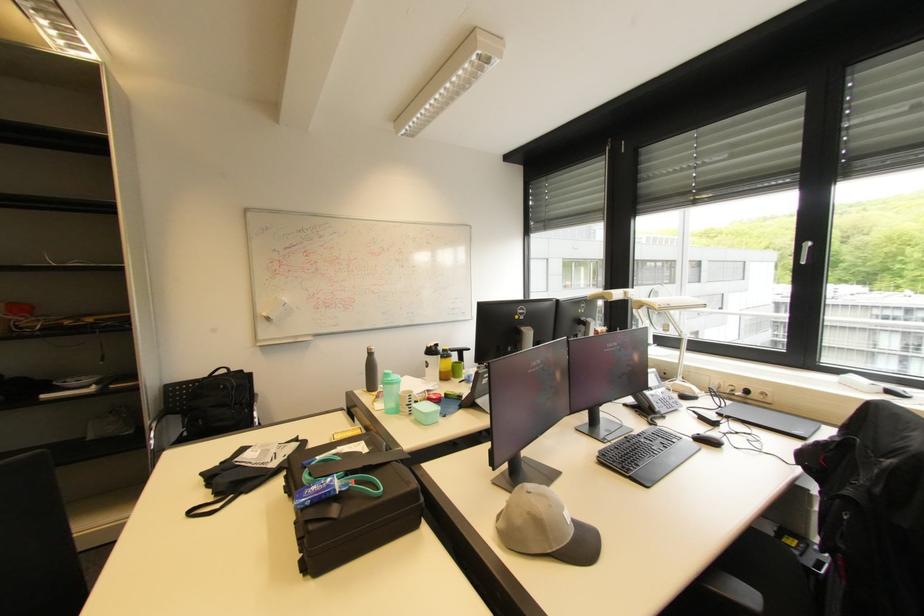
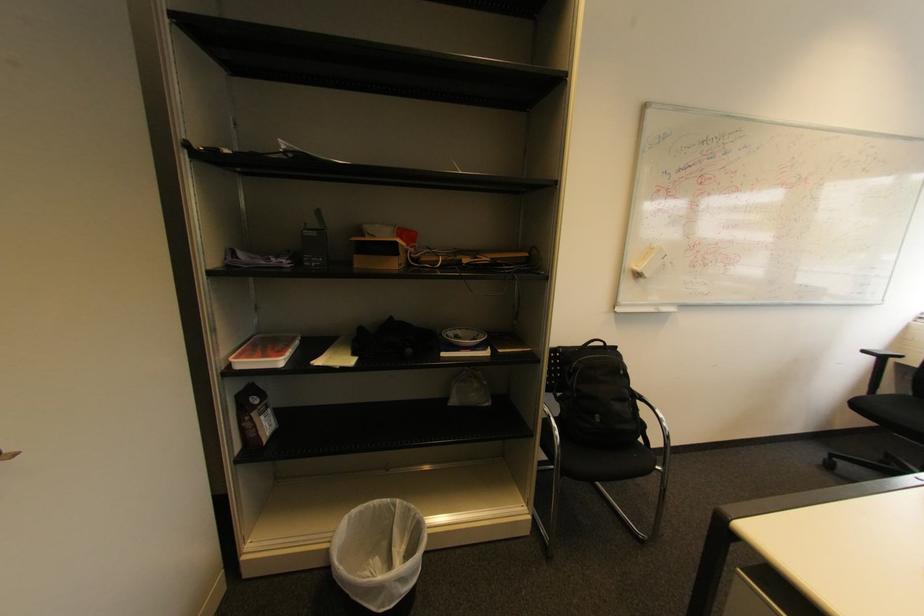
Find the pixel in the second image that matches pixel 89 379 in the first image.

(464, 333)